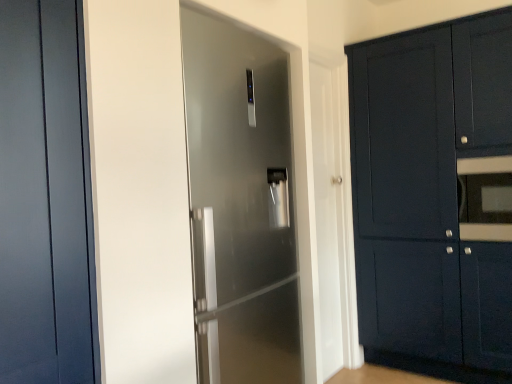
Question: Does matte black oven at right turn towards matte dark blue cabinet at right?

Choices:
 (A) yes
 (B) no

Answer: (A)

Question: From the image's perspective, is matte black oven at right on top of matte dark blue cabinet at right?

Choices:
 (A) no
 (B) yes

Answer: (B)

Question: From a real-world perspective, is matte black oven at right on matte dark blue cabinet at right?

Choices:
 (A) yes
 (B) no

Answer: (A)

Question: Considering the relative positions of matte black oven at right and matte dark blue cabinet at right in the image provided, is matte black oven at right behind matte dark blue cabinet at right?

Choices:
 (A) yes
 (B) no

Answer: (A)

Question: Is matte black oven at right shorter than matte dark blue cabinet at right?

Choices:
 (A) no
 (B) yes

Answer: (B)

Question: Is matte black oven at right not inside matte dark blue cabinet at right?

Choices:
 (A) yes
 (B) no

Answer: (B)

Question: Does matte dark blue cabinet at right have a greater width compared to matte black oven at right?

Choices:
 (A) yes
 (B) no

Answer: (A)

Question: Is matte dark blue cabinet at right surrounding matte black oven at right?

Choices:
 (A) yes
 (B) no

Answer: (A)

Question: Considering the relative positions of matte dark blue cabinet at right and matte black oven at right in the image provided, is matte dark blue cabinet at right to the left of matte black oven at right from the viewer's perspective?

Choices:
 (A) no
 (B) yes

Answer: (B)

Question: Can you confirm if matte dark blue cabinet at right is positioned to the right of matte black oven at right?

Choices:
 (A) yes
 (B) no

Answer: (B)

Question: Is matte dark blue cabinet at right bigger than matte black oven at right?

Choices:
 (A) no
 (B) yes

Answer: (B)

Question: Does matte dark blue cabinet at right have a lesser width compared to matte black oven at right?

Choices:
 (A) yes
 (B) no

Answer: (B)

Question: From a real-world perspective, is matte dark blue door at left, the second door when ordered from back to front, over satin silver refrigerator at center, the 1th door from the right?

Choices:
 (A) yes
 (B) no

Answer: (A)